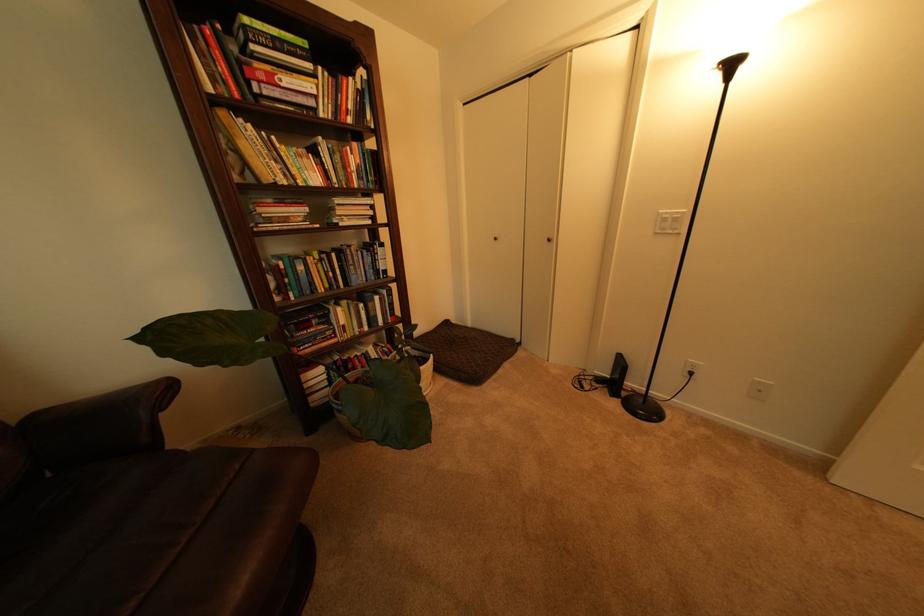
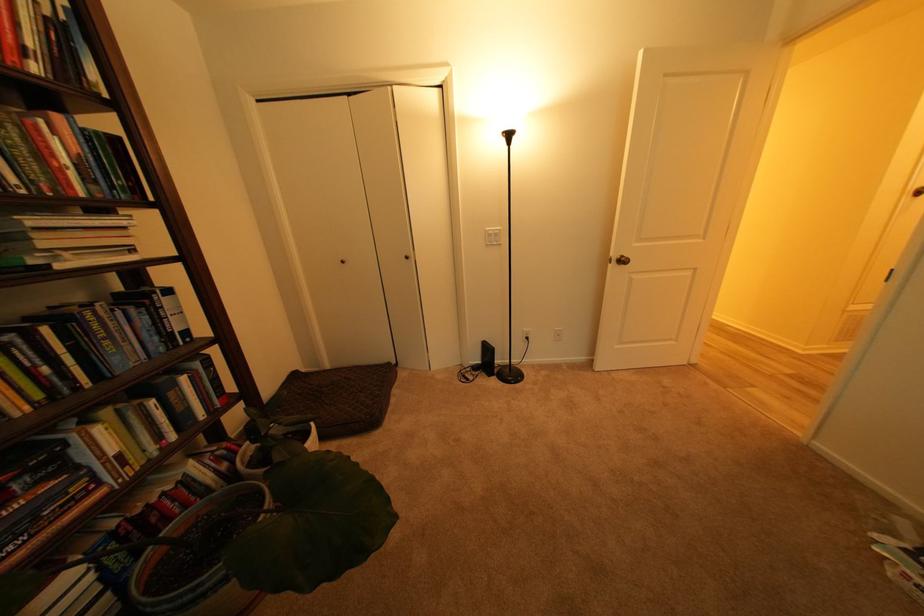
In the second image, find the point that corresponds to [359,333] in the first image.

(141, 463)